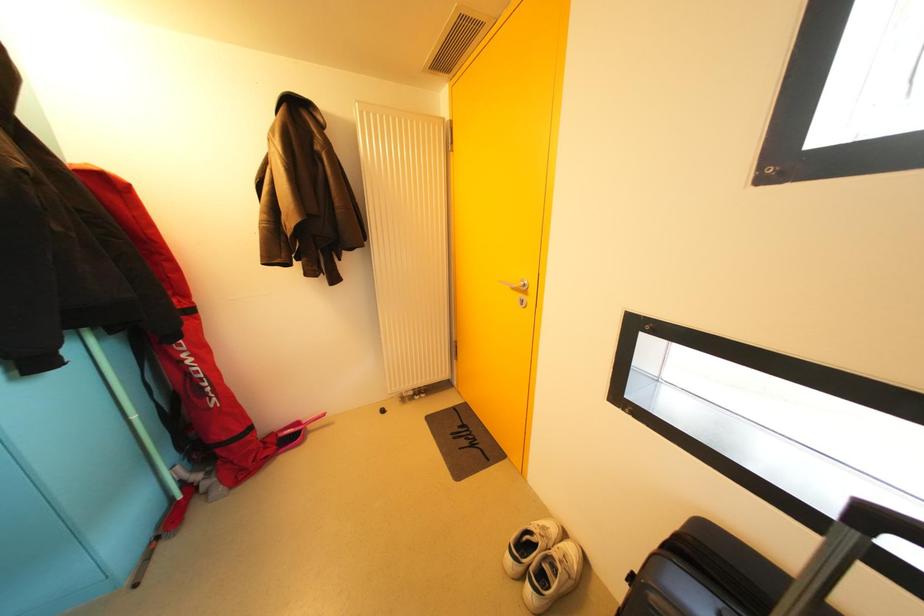
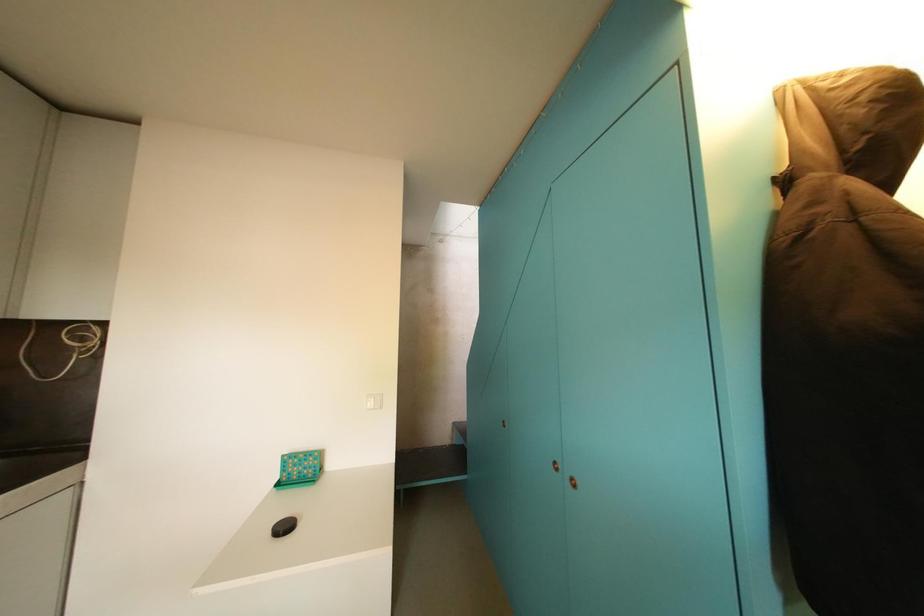
Question: The first image is from the beginning of the video and the second image is from the end. How did the camera likely rotate when shooting the video?

Choices:
 (A) Left
 (B) Right
 (C) Up
 (D) Down

Answer: (A)